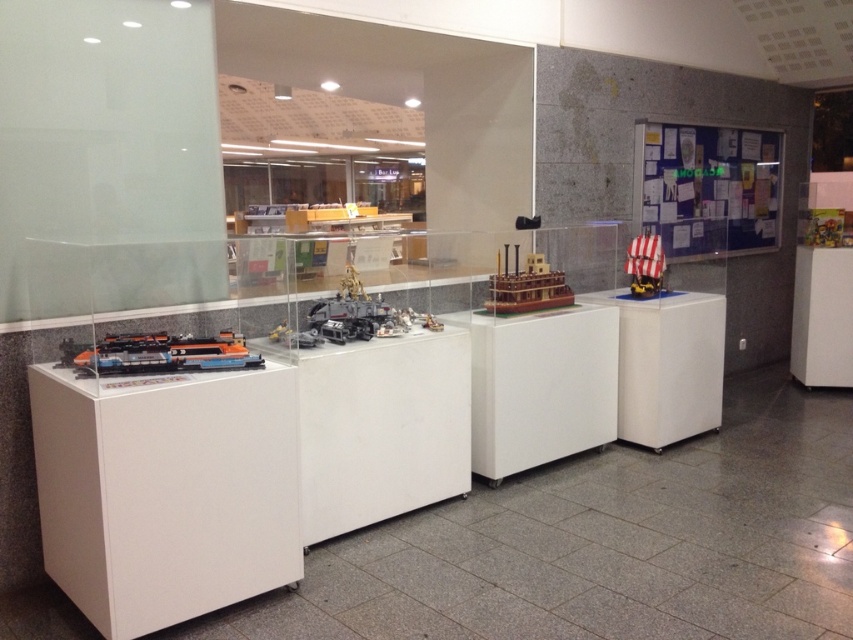
You are organizing a childrens event and need to place a 1.2 meter wide game board between the white plastic table at right and the white striped wood ship at right. Is there enough space between them to fit the game board?

The white plastic table at right is to the right of the white striped wood ship at right. The distance between them is not specified, so it is uncertain if the 1.2 meter wide game board can fit. Additional information about the spacing between the two objects is needed to determine feasibility.

You are a visitor in the display area and want to see the white striped wood ship at right. However, you notice the white plastic table at right is blocking your view. Can you see the ship over the table?

The white plastic table at right is taller than the white striped wood ship at right, so the table is blocking the view of the ship.

You are a visitor standing at the entrance of the display area. You want to take a photo of the shiny metallic train at left. Where should you stand to ensure it is centered in your camera viewfinder?

To center the shiny metallic train at left in your camera viewfinder, you should position yourself directly in front of its location at point (158, 353).